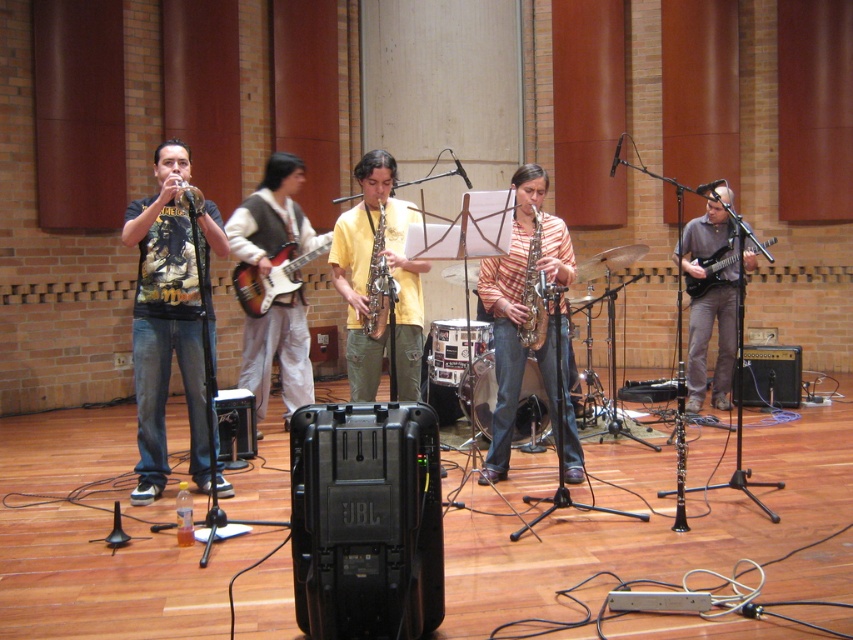
Can you confirm if yellow matte saxophone at center is wider than gold metallic saxophone at center?

Yes.

Between point (393, 180) and point (541, 225), which one is positioned behind?

The point (393, 180) is more distant.

Locate an element on the screen. This screenshot has width=853, height=640. yellow matte saxophone at center is located at coordinates (368, 276).

This screenshot has height=640, width=853. Find the location of `yellow matte saxophone at center`. yellow matte saxophone at center is located at coordinates (368, 276).

Which is more to the right, matte black t-shirt at left or light brown fabric vest at center?

Positioned to the right is light brown fabric vest at center.

Is matte black t-shirt at left below light brown fabric vest at center?

Yes, matte black t-shirt at left is below light brown fabric vest at center.

Is point (192, 342) behind point (314, 246)?

No, it is in front of (314, 246).

This screenshot has width=853, height=640. Find the location of `matte black t-shirt at left`. matte black t-shirt at left is located at coordinates (165, 324).

Is striped fabric saxophone at center smaller than light brown fabric vest at center?

Correct, striped fabric saxophone at center occupies less space than light brown fabric vest at center.

Is point (569, 412) farther from viewer compared to point (303, 218)?

No, it is not.

Is point (566, 275) positioned in front of point (253, 364)?

Yes, it is in front of point (253, 364).

Find the location of a particular element. This screenshot has width=853, height=640. striped fabric saxophone at center is located at coordinates (509, 314).